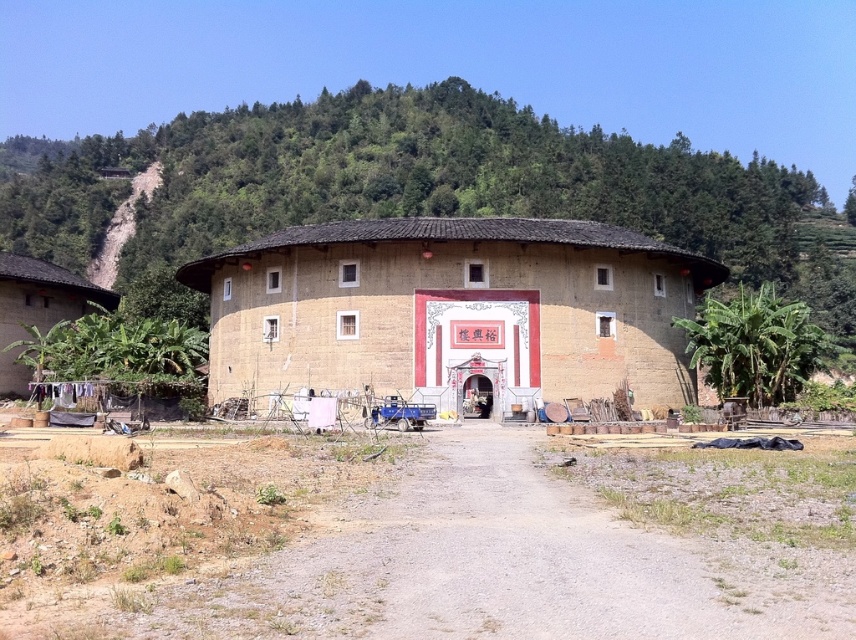
You are a visitor approaching the brown clay house at center and the earthy clay roundhouse at center. Based on their sizes, which one would you estimate to be the main building intended for community gatherings?

The brown clay house at center is larger in size than the earthy clay roundhouse at center, so it is more likely to be the main building intended for community gatherings due to its size.